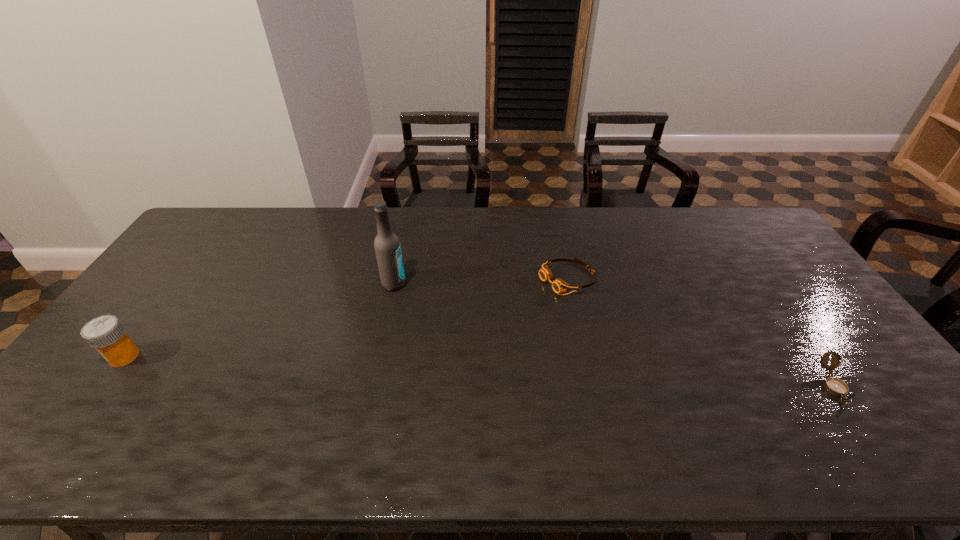
Find the location of a particular element. The width and height of the screenshot is (960, 540). the leftmost object is located at coordinates (106, 334).

Where is `medicine`? The width and height of the screenshot is (960, 540). medicine is located at coordinates (106, 334).

This screenshot has height=540, width=960. What are the coordinates of `the rightmost object` in the screenshot? It's located at (835, 386).

The width and height of the screenshot is (960, 540). Find the location of `the third tallest object`. the third tallest object is located at coordinates (835, 386).

Where is `goggles`? The height and width of the screenshot is (540, 960). goggles is located at coordinates (559, 286).

I want to click on the shortest object, so click(559, 286).

Find the location of a particular element. The height and width of the screenshot is (540, 960). beer bottle is located at coordinates (387, 247).

Find the location of a particular element. This screenshot has width=960, height=540. the third object from right to left is located at coordinates pyautogui.click(x=387, y=247).

The height and width of the screenshot is (540, 960). I want to click on vacant region located 0.060m with the lenses facing forward on the third object from left to right, so click(529, 295).

The image size is (960, 540). In order to click on free space located 0.240m with the lenses facing forward on the third object from left to right in this screenshot , I will do `click(479, 319)`.